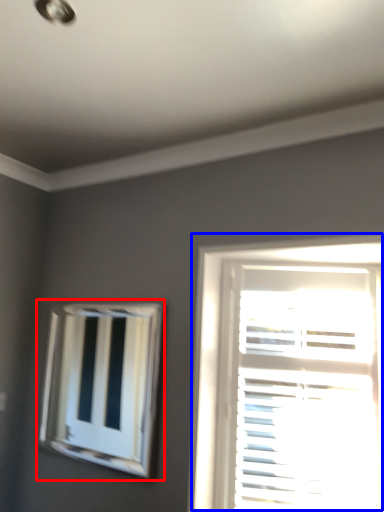
Question: Which of the following is the farthest to the observer, bay window (highlighted by a red box) or window (highlighted by a blue box)?

Choices:
 (A) bay window
 (B) window

Answer: (A)